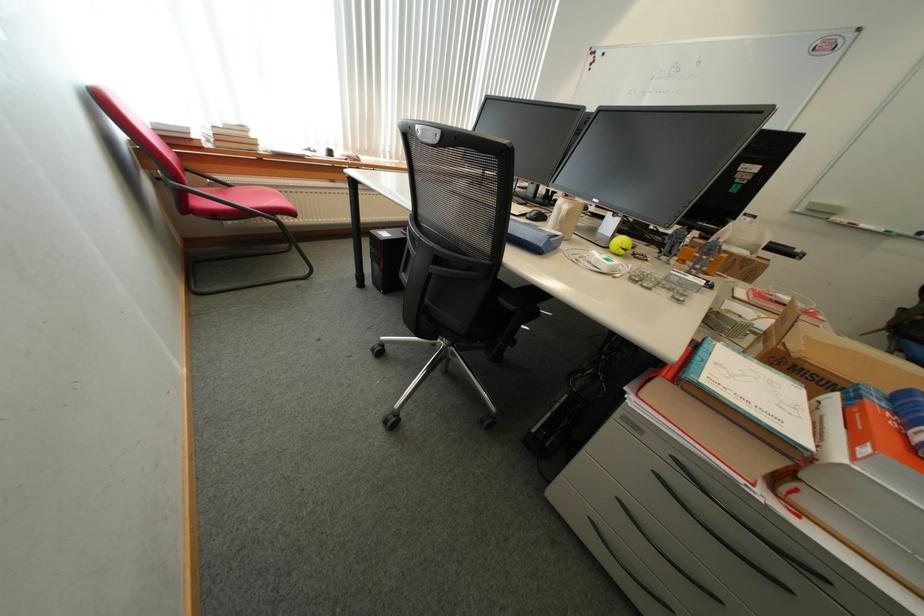
In order to click on red chair sitting surface in this screenshot , I will do `click(242, 201)`.